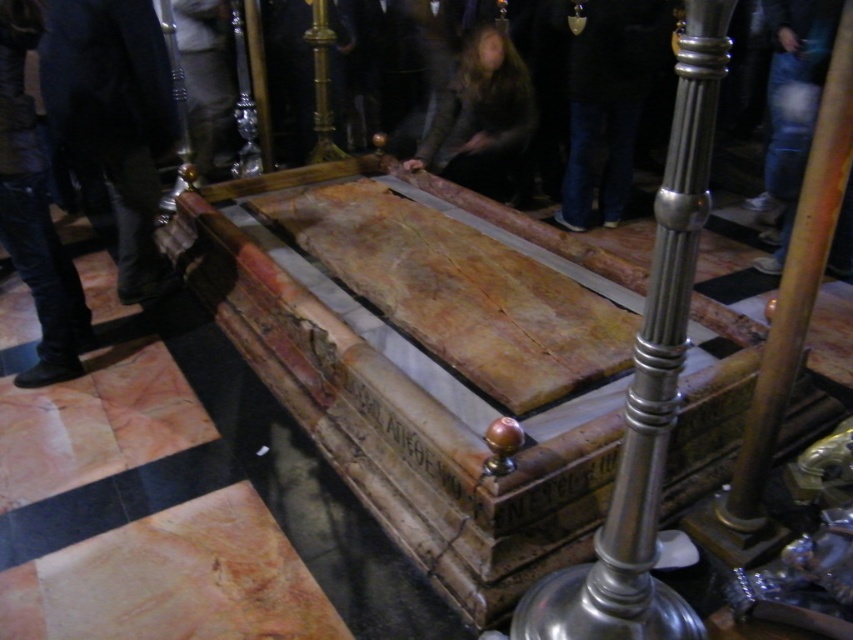
Can you confirm if dark blue jeans at lower left is thinner than dark brown leather jacket at center?

Indeed, dark blue jeans at lower left has a lesser width compared to dark brown leather jacket at center.

Is dark blue jeans at lower left taller than dark brown leather jacket at center?

Indeed, dark blue jeans at lower left has a greater height compared to dark brown leather jacket at center.

Does point (114, 13) lie behind point (508, 58)?

No, (114, 13) is closer to viewer.

The width and height of the screenshot is (853, 640). In order to click on dark blue jeans at lower left in this screenshot , I will do 114,120.